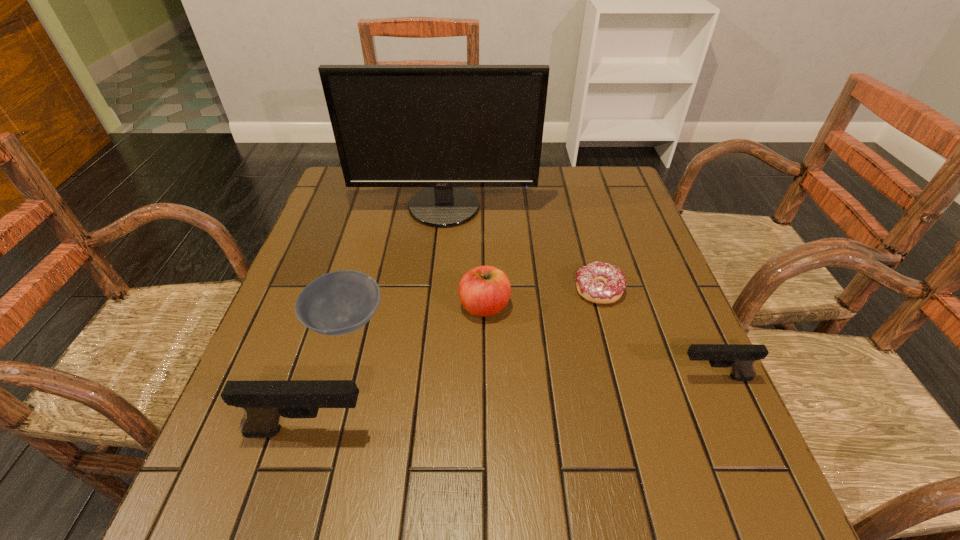
At what (x,y) coordinates should I click in order to perform the action: click on vacant space at the right edge. Please return your answer as a coordinate pair (x, y). The image size is (960, 540). Looking at the image, I should click on (691, 400).

Locate an element on the screen. This screenshot has height=540, width=960. vacant space at the far left corner of the desktop is located at coordinates (381, 199).

In the image, there is a desktop. At what (x,y) coordinates should I click in order to perform the action: click on free region at the near left corner. Please return your answer as a coordinate pair (x, y). This screenshot has height=540, width=960. Looking at the image, I should click on (227, 444).

The height and width of the screenshot is (540, 960). In the image, there is a desktop. Find the location of `vacant space at the far right corner`. vacant space at the far right corner is located at coordinates (618, 200).

Locate an element on the screen. The height and width of the screenshot is (540, 960). empty space between the fifth tallest object and the nearest object is located at coordinates (326, 376).

Find the location of `vacant space that is in between the taller pistol and the rightmost object`. vacant space that is in between the taller pistol and the rightmost object is located at coordinates (511, 404).

The image size is (960, 540). Find the location of `vacant area that lies between the apple and the taller pistol`. vacant area that lies between the apple and the taller pistol is located at coordinates (396, 369).

You are a GUI agent. You are given a task and a screenshot of the screen. Output one action in this format:
    pyautogui.click(x=<x>, y=<y>)
    Task: Click on the free space between the apple and the second shortest object
    The height and width of the screenshot is (540, 960).
    Given the screenshot: What is the action you would take?
    pyautogui.click(x=415, y=314)

Locate an element on the screen. This screenshot has height=540, width=960. vacant space that is in between the apple and the doughnut is located at coordinates (541, 298).

You are a GUI agent. You are given a task and a screenshot of the screen. Output one action in this format:
    pyautogui.click(x=<x>, y=<y>)
    Task: Click on the empty space between the fifth shortest object and the fifth tallest object
    The width and height of the screenshot is (960, 540).
    Given the screenshot: What is the action you would take?
    pyautogui.click(x=326, y=376)